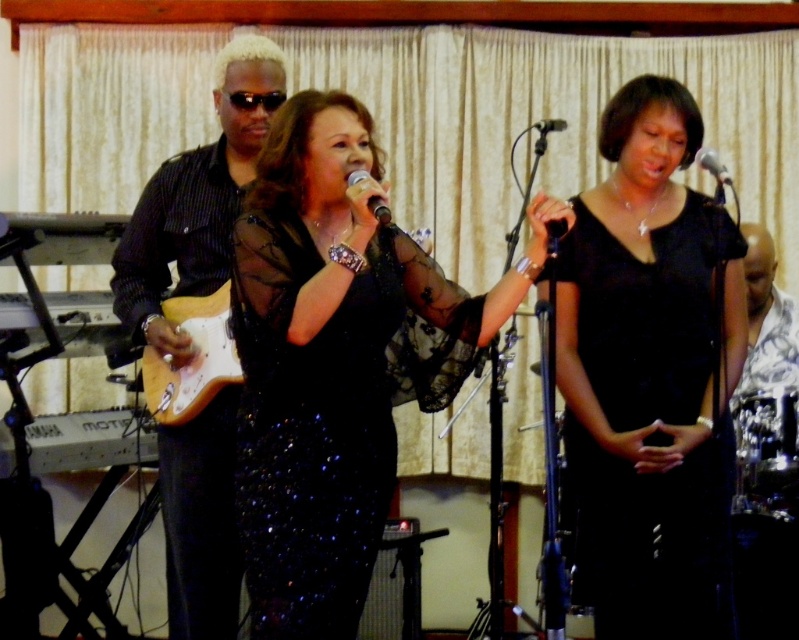
Question: Which object is farther from the camera taking this photo?

Choices:
 (A) black satin dress at center
 (B) shiny black shirt at left
 (C) light wood electric guitar at center

Answer: (B)

Question: Is sparkly black dress at center closer to the viewer compared to metallic silver microphone at upper center?

Choices:
 (A) no
 (B) yes

Answer: (B)

Question: Which object appears farthest from the camera in this image?

Choices:
 (A) metallic silver microphone at upper center
 (B) black satin dress at center
 (C) black metallic microphone at center
 (D) light wood electric guitar at center

Answer: (B)

Question: Observing the image, what is the correct spatial positioning of black satin dress at center in reference to light wood electric guitar at center?

Choices:
 (A) above
 (B) below

Answer: (B)

Question: Among these objects, which one is nearest to the camera?

Choices:
 (A) light wood electric guitar at center
 (B) black metallic microphone at center
 (C) sparkly black dress at center

Answer: (B)

Question: Does light wood electric guitar at center have a lesser width compared to black metallic microphone at center?

Choices:
 (A) yes
 (B) no

Answer: (B)